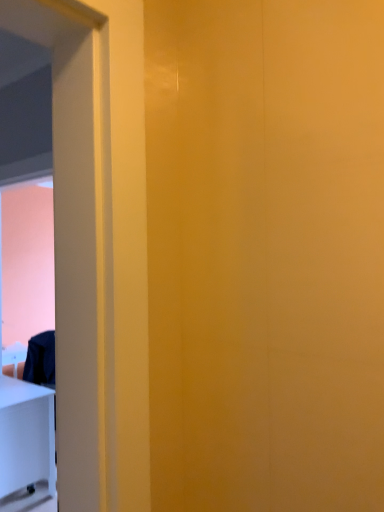
Question: Is point (16, 380) positioned closer to the camera than point (97, 485)?

Choices:
 (A) farther
 (B) closer

Answer: (A)

Question: Is white glossy table at lower left situated inside white glossy screen door at left or outside?

Choices:
 (A) outside
 (B) inside

Answer: (A)

Question: In terms of size, does white glossy table at lower left appear bigger or smaller than white glossy screen door at left?

Choices:
 (A) small
 (B) big

Answer: (A)

Question: Considering the positions of white glossy screen door at left and white glossy table at lower left in the image, is white glossy screen door at left wider or thinner than white glossy table at lower left?

Choices:
 (A) thin
 (B) wide

Answer: (A)

Question: In terms of size, does white glossy screen door at left appear bigger or smaller than white glossy table at lower left?

Choices:
 (A) big
 (B) small

Answer: (A)

Question: Considering the positions of point (87, 389) and point (34, 479), is point (87, 389) closer or farther from the camera than point (34, 479)?

Choices:
 (A) closer
 (B) farther

Answer: (A)

Question: In terms of height, does white glossy screen door at left look taller or shorter compared to white glossy table at lower left?

Choices:
 (A) tall
 (B) short

Answer: (A)